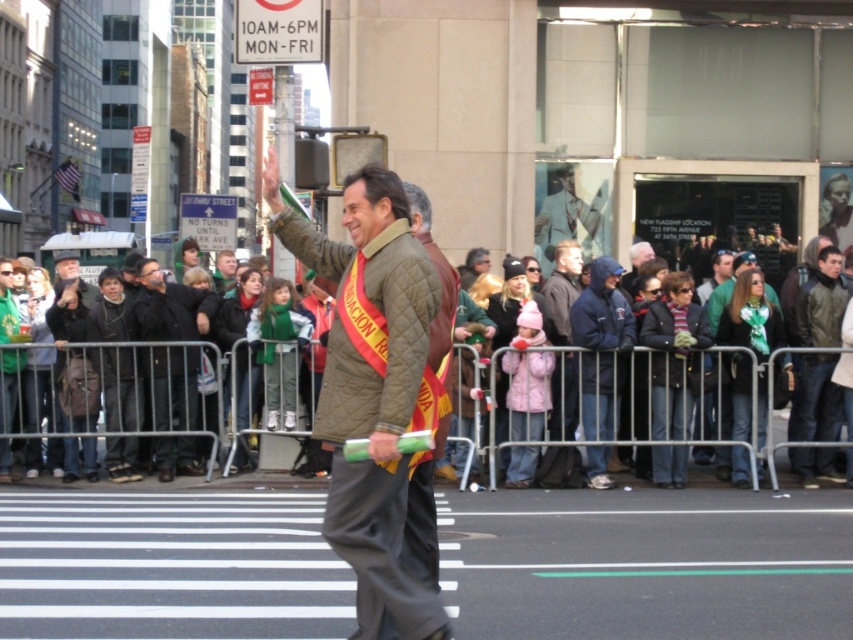
You are a photographer trying to capture a photo of the green wool scarf at center and the dark gray jacket at left. Since you want both in the frame, which object should you position closer to the left side of the camera viewfinder?

The dark gray jacket at left should be positioned closer to the left side of the camera viewfinder because it is already on the left side of the green wool scarf at center.

You are a photographer trying to capture a photo of the dark blue jeans at center and the dark gray jacket at left. Which object should you zoom in on to ensure both are clearly visible in the frame?

The dark blue jeans at center has a lesser width compared to dark gray jacket at left, so you should zoom in on the dark gray jacket at left to ensure both are clearly visible in the frame.

You are a photographer trying to capture a detailed shot of the leather jacket at center and the green wool scarf at center. Which object would you need to zoom in more on to ensure clarity, considering their sizes?

The leather jacket at center has a lesser width compared to the green wool scarf at center, so you would need to zoom in more on the leather jacket at center to ensure clarity due to its smaller size.